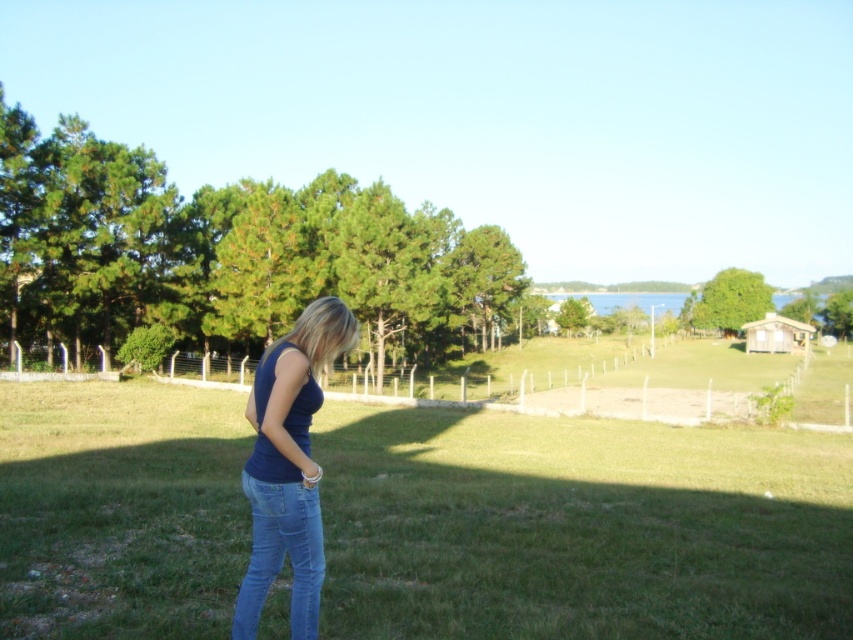
Who is positioned more to the right, green grass at center or blue denim jeans at center?

green grass at center

Does green grass at center have a greater width compared to blue denim jeans at center?

Indeed, green grass at center has a greater width compared to blue denim jeans at center.

Between point (97, 625) and point (294, 595), which one is positioned in front?

Point (294, 595) is in front.

Where is `green grass at center`? The image size is (853, 640). green grass at center is located at coordinates (579, 528).

Who is more distant from viewer, [251,608] or [321,532]?

Positioned behind is point [321,532].

Is point (306, 616) positioned in front of point (258, 586)?

No, (306, 616) is further to viewer.

You are a GUI agent. You are given a task and a screenshot of the screen. Output one action in this format:
    pyautogui.click(x=<x>, y=<y>)
    Task: Click on the matte blue tank top at center
    The height and width of the screenshot is (640, 853).
    Given the screenshot: What is the action you would take?
    pyautogui.click(x=288, y=467)

Does point (709, 564) lie behind point (312, 596)?

Yes, point (709, 564) is behind point (312, 596).

Between green grass at center and matte blue tank top at center, which one appears on the left side from the viewer's perspective?

matte blue tank top at center

Image resolution: width=853 pixels, height=640 pixels. I want to click on green grass at center, so click(x=579, y=528).